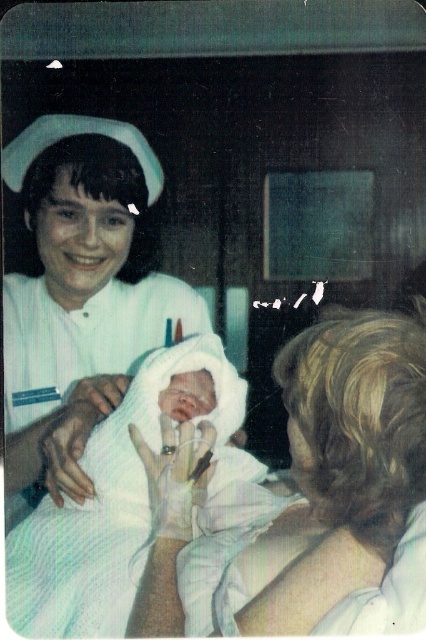
You are a nurse who needs to reach the smooth white towel at center to clean a medical instrument. You are currently standing 1 meter away from it. Can you comfortably reach the towel without moving your position?

The smooth white towel at center is 1.02 meters away from the viewer, so you cannot comfortably reach it without moving closer since you are 1 meter away.

You are a photographer setting up for a photo shoot in a hospital room. You have a smooth white towel at center and a white smooth nurse cap at upper left. Which object should you focus on first if you want to capture the larger object in your shot?

The smooth white towel at center should be focused on first because it has a larger size compared to the white smooth nurse cap at upper left.